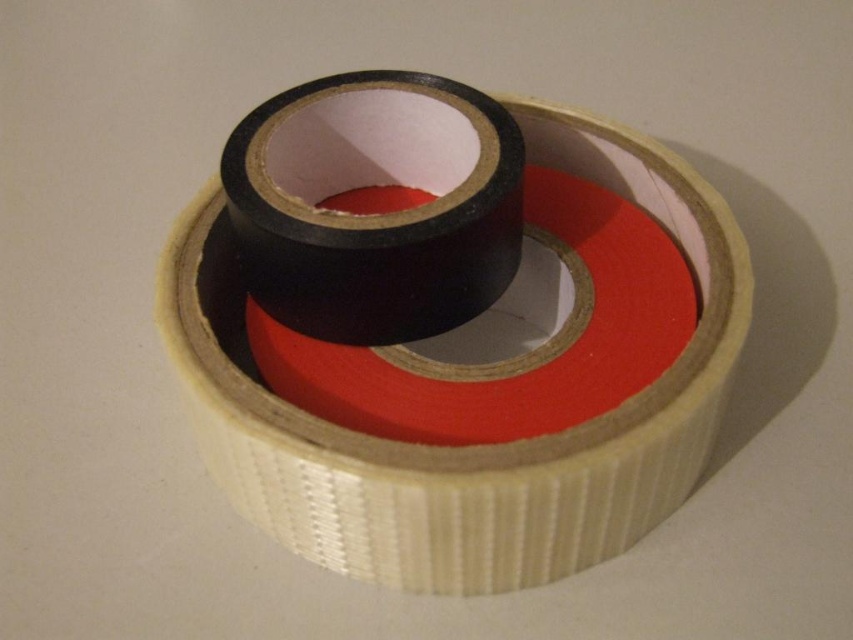
Who is more forward, (534, 474) or (352, 266)?

Positioned in front is point (534, 474).

Measure the distance from black matte tape at center to matte black tape at center.

black matte tape at center and matte black tape at center are 7.71 inches apart.

Does point (289, 420) come farther from viewer compared to point (357, 339)?

That is False.

The height and width of the screenshot is (640, 853). What are the coordinates of `black matte tape at center` in the screenshot? It's located at (471, 449).